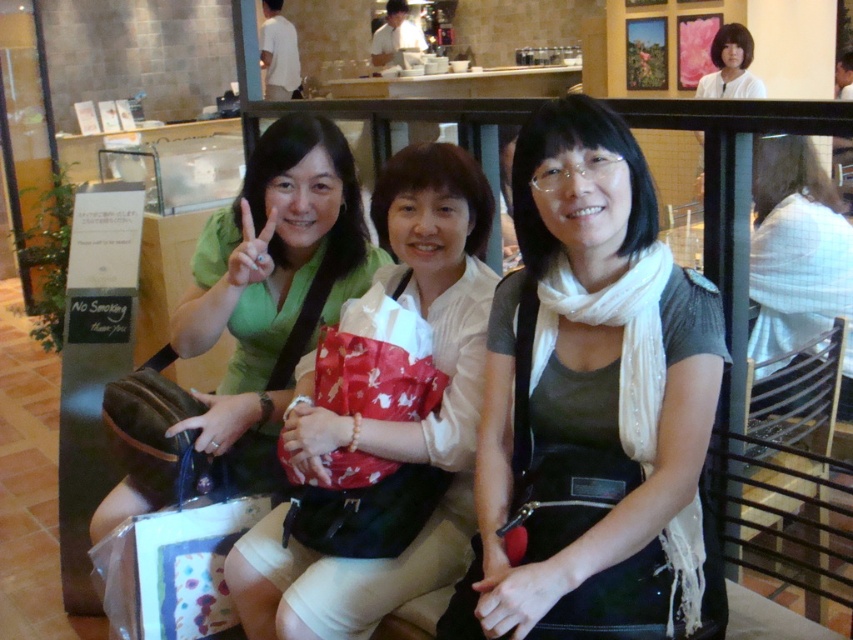
Where is the white satin scarf at center located in the image?

The white satin scarf at center is located at point 0.631 in the x coordinate and 0.694 in the y coordinate.

You are standing 5 feet away from the counter in the background. Can you reach the point at coordinates point [567,620] without moving closer?

The distance of point [567,620] from viewer is 3.92 feet. Since you are currently 5 feet away, you are too far to reach it without moving closer.

You are a photographer adjusting your camera settings. You want to focus on the white satin scarf at center and the white fabric shirt at upper right. Which object should you adjust your focus to first if you want to ensure both are in focus?

The white satin scarf at center should be focused on first since it is closer to the camera than the white fabric shirt at upper right. By focusing on the closer object, the farther one may still be in focus depending on the depth of field.